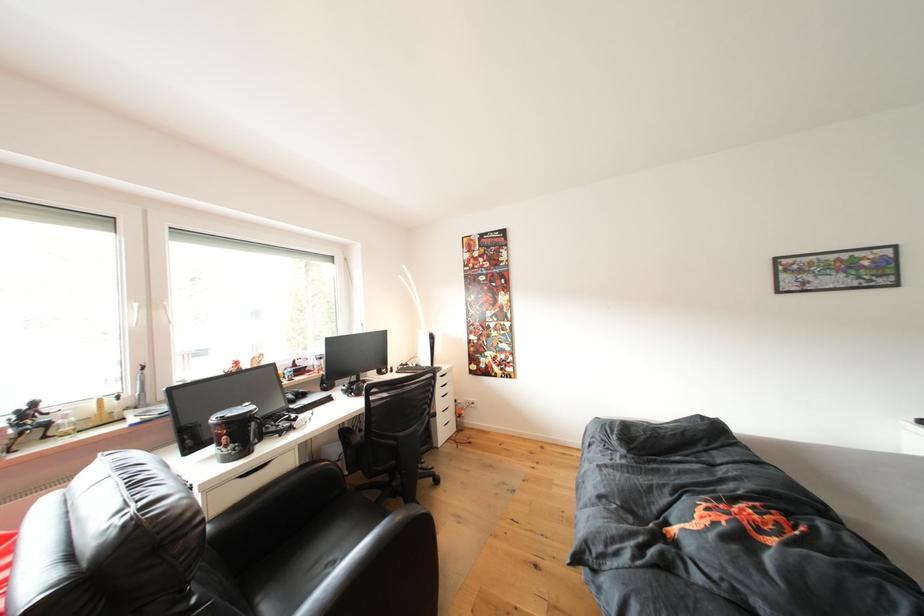
Find where to pull the desk drawer handle. Please return your answer as a coordinate pair (x, y).

(254, 469)